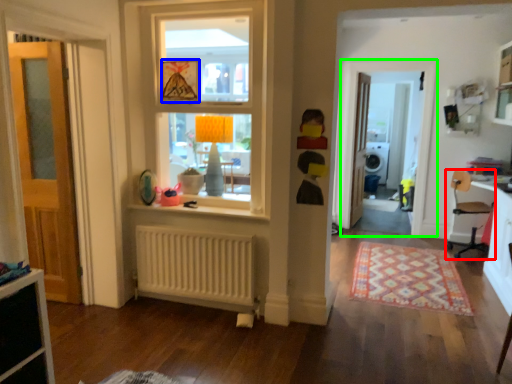
Question: Based on their relative distances, which object is nearer to chair (highlighted by a red box)? Choose from picture frame (highlighted by a blue box) and screen door (highlighted by a green box).

Choices:
 (A) picture frame
 (B) screen door

Answer: (B)